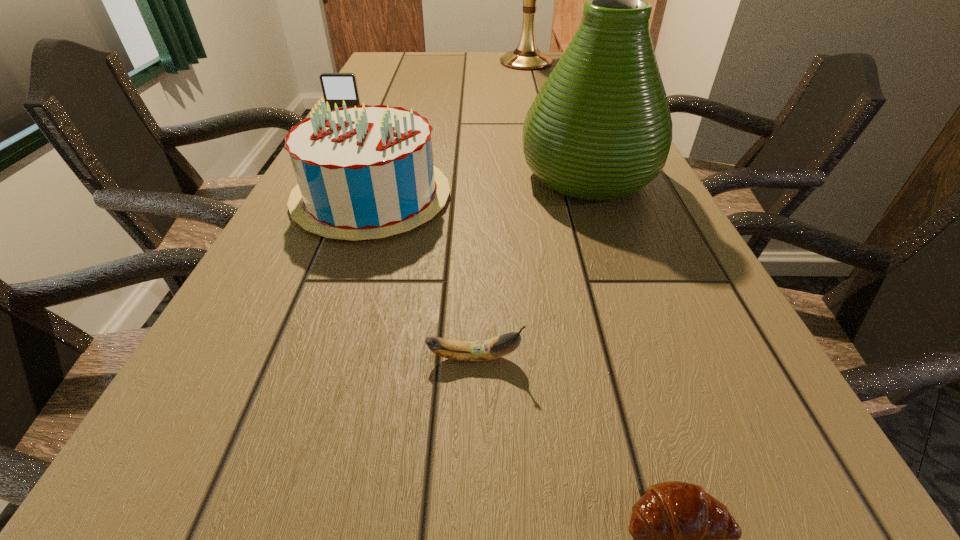
Find the location of `the tallest object`. the tallest object is located at coordinates (526, 56).

I want to click on the farthest object, so click(x=526, y=56).

Image resolution: width=960 pixels, height=540 pixels. What are the coordinates of `the fifth shortest object` in the screenshot? It's located at (600, 128).

Identify the location of birthday cake. The height and width of the screenshot is (540, 960). (365, 172).

You are a GUI agent. You are given a task and a screenshot of the screen. Output one action in this format:
    pyautogui.click(x=<x>, y=<y>)
    Task: Click on the iPod
    The image size is (960, 540).
    Given the screenshot: What is the action you would take?
    pyautogui.click(x=336, y=87)

Identify the location of the fourth tallest object. (336, 87).

In order to click on the second shortest object in this screenshot , I will do (478, 350).

The height and width of the screenshot is (540, 960). What are the coordinates of `banana` in the screenshot? It's located at (478, 350).

Where is `vacant region located 0.230m on the front of the trophy cup`? vacant region located 0.230m on the front of the trophy cup is located at coordinates (535, 98).

The width and height of the screenshot is (960, 540). I want to click on vacant region located 0.230m on the left of the vase, so click(x=416, y=177).